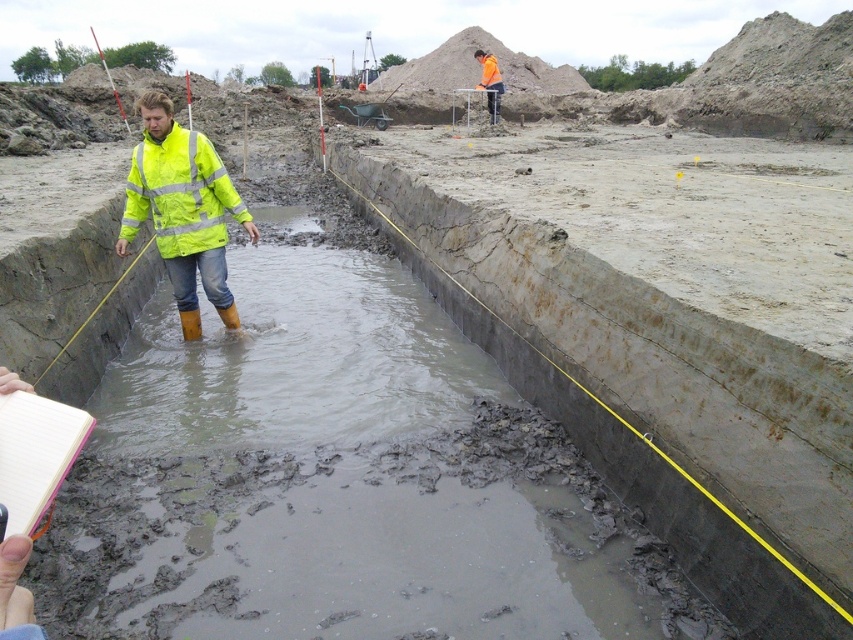
You are an archaeologist working at the excavation site. You notice two jackets in the trench. Which jacket is covering the other one, the neon yellow reflective jacket at center or the high visibility yellow jacket at center?

The neon yellow reflective jacket at center is positioned over the high visibility yellow jacket at center, so it is covering the other one.

You are an archaeologist at the excavation site. You need to hand a tool to the person in the neon yellow reflective jacket at center. Which direction should you walk from the orange reflective jacket at upper center to reach them?

The neon yellow reflective jacket at center is to the left of the orange reflective jacket at upper center, so you should walk to the left to reach them.